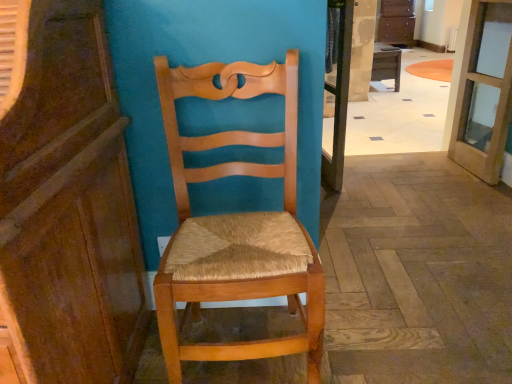
Question: Is clear glass door at upper right taller or shorter than wooden desk at center?

Choices:
 (A) short
 (B) tall

Answer: (B)

Question: Is point (499, 21) closer or farther from the camera than point (381, 74)?

Choices:
 (A) closer
 (B) farther

Answer: (A)

Question: Which object is the closest to the wooden cabinet at left?

Choices:
 (A) wooden woven seat chair at center
 (B) clear glass screen door at center
 (C) polished wood floor at center
 (D) wooden desk at center
 (E) clear glass door at upper right

Answer: (A)

Question: Which object is the farthest from the polished wood floor at center?

Choices:
 (A) clear glass door at upper right
 (B) clear glass screen door at center
 (C) wooden woven seat chair at center
 (D) wooden desk at center
 (E) wooden cabinet at left

Answer: (E)